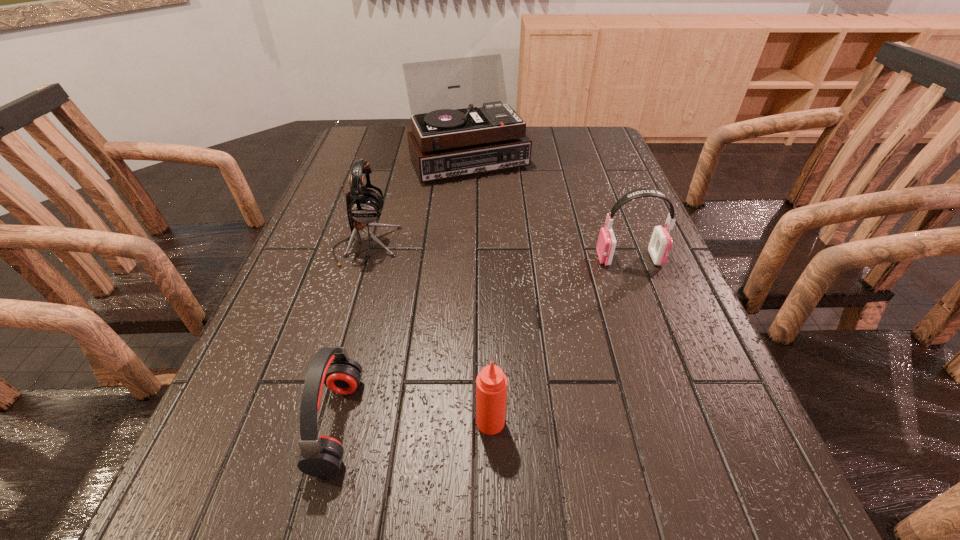
Where is `free space that satisfies the following two spatial constraints: 1. on the front side of the Tabasco sauce; 2. on the right side of the record player`? The image size is (960, 540). free space that satisfies the following two spatial constraints: 1. on the front side of the Tabasco sauce; 2. on the right side of the record player is located at coordinates 459,422.